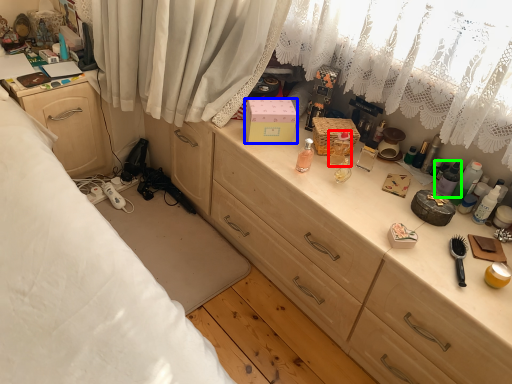
Question: Based on their relative distances, which object is farther from toiletry (highlighted by a red box)? Choose from box (highlighted by a blue box) and toiletry (highlighted by a green box).

Choices:
 (A) box
 (B) toiletry

Answer: (B)